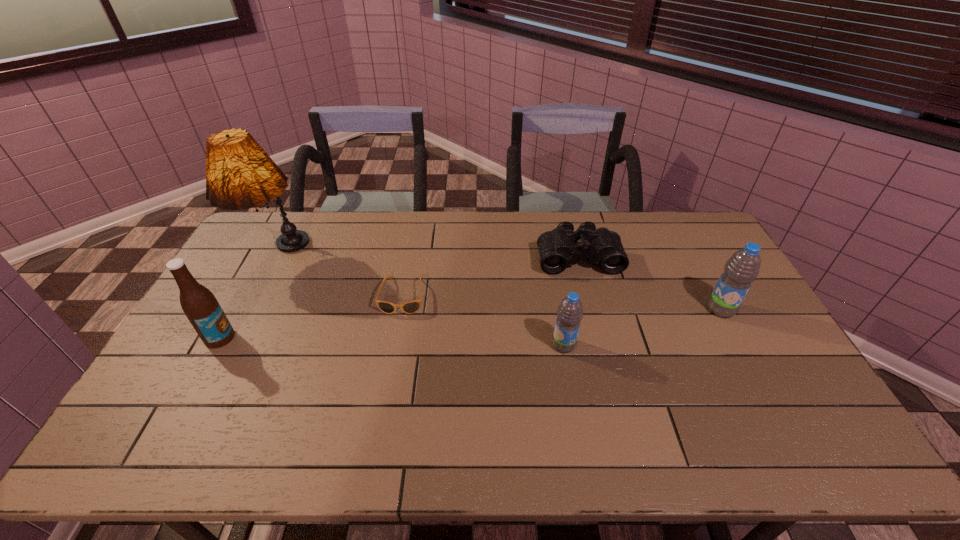
Find the location of a particular element. The width and height of the screenshot is (960, 540). free location located on the front of the rightmost object is located at coordinates (758, 379).

Locate an element on the screen. vacant space situated on the front-facing side of the lampshade is located at coordinates (216, 380).

Image resolution: width=960 pixels, height=540 pixels. What are the coordinates of `vacant area situated on the front-facing side of the shortest object` in the screenshot? It's located at (388, 379).

Identify the location of vacant space located on the front of the beer bottle. (201, 373).

Locate an element on the screen. free space located at the eyepieces of the second shortest object is located at coordinates pos(604,357).

Locate an element on the screen. lampshade that is at the far edge is located at coordinates (239, 174).

The width and height of the screenshot is (960, 540). Identify the location of binoculars that is at the far edge. (557, 248).

Locate an element on the screen. The height and width of the screenshot is (540, 960). lampshade at the left edge is located at coordinates (239, 174).

Find the location of `beer bottle positioned at the left edge`. beer bottle positioned at the left edge is located at coordinates (202, 309).

In order to click on object that is at the right edge in this screenshot , I will do `click(742, 268)`.